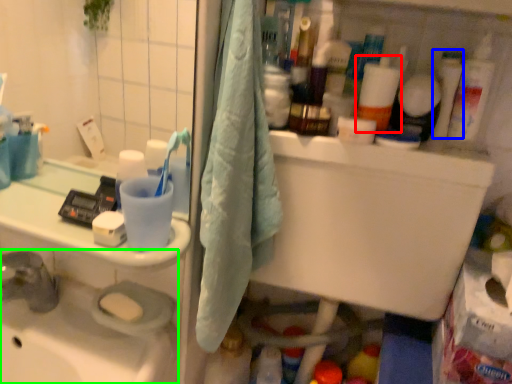
Question: Estimate the real-world distances between objects in this image. Which object is farther from cleaning product (highlighted by a red box), toiletry (highlighted by a blue box) or sink (highlighted by a green box)?

Choices:
 (A) toiletry
 (B) sink

Answer: (B)